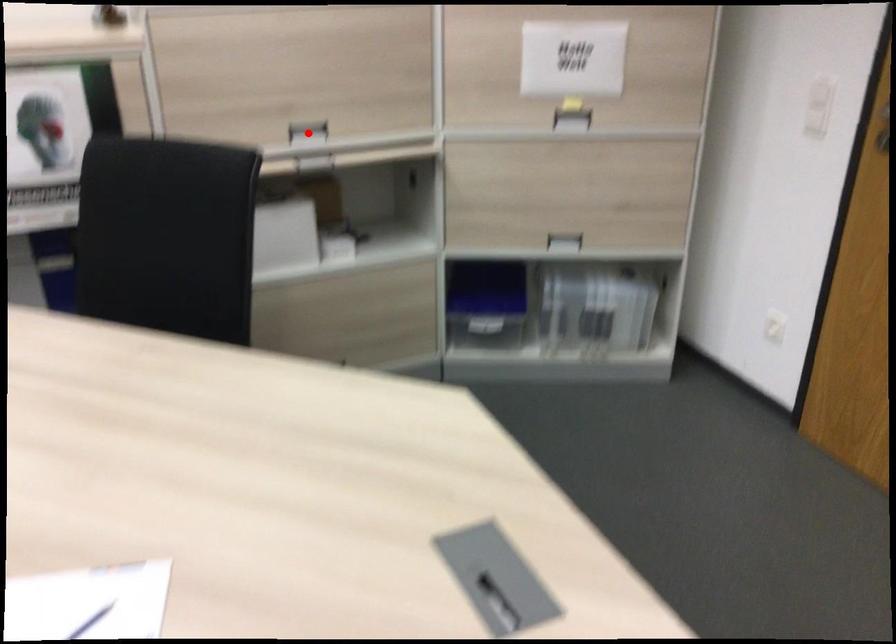
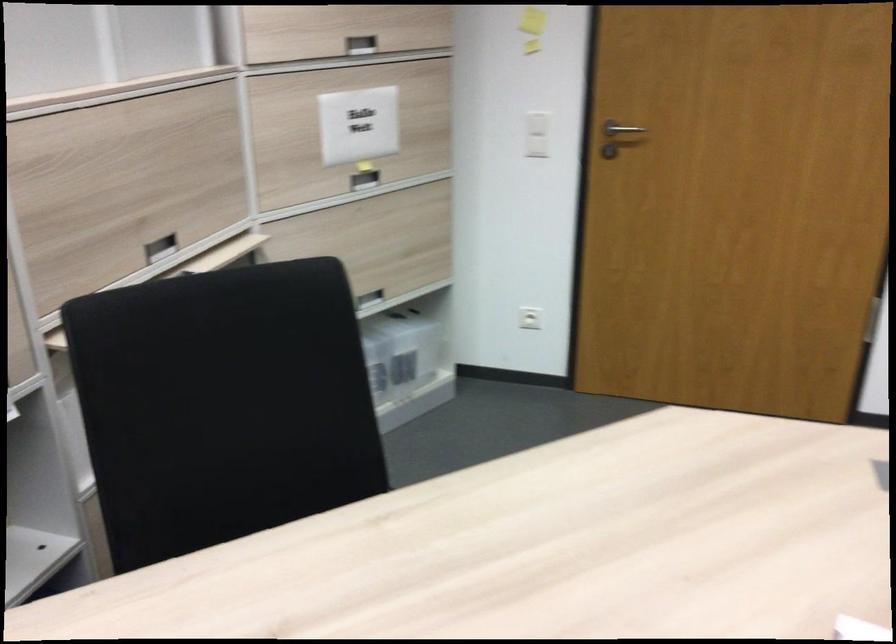
The point at the highlighted location is marked in the first image. Where is the corresponding point in the second image?

(159, 247)